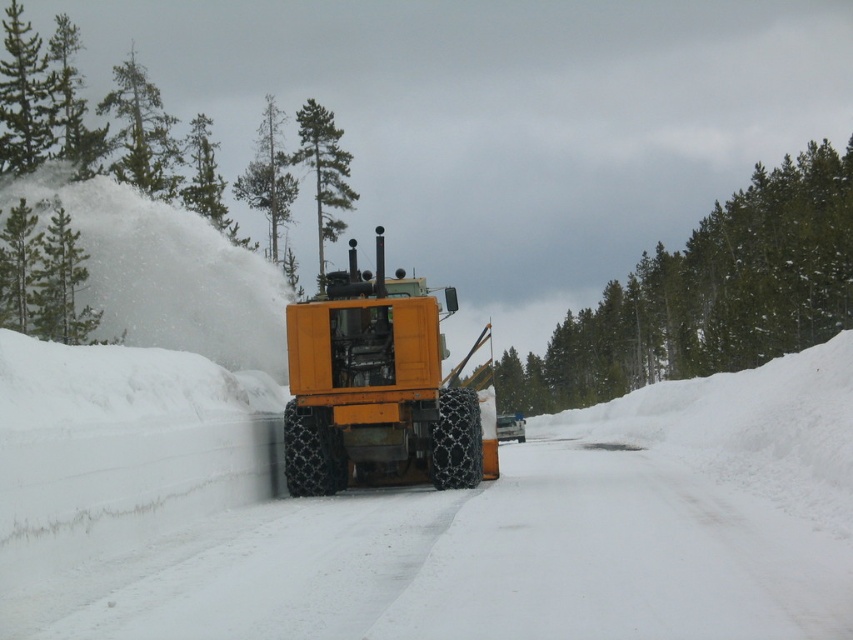
You are standing at the point with coordinates point (840, 468) and want to move towards the point with coordinates point (467, 465). Given that the snowplow is actively clearing the road, which direction should you walk to reach your destination?

Since point (840, 468) is closer to the camera than point (467, 465), you should walk away from the camera towards the snowplow to reach your destination.

You are a delivery driver trying to navigate through the snow. You see the point marked at coordinate (459, 528). What object is located at that point?

The point at coordinate (459, 528) indicates the yellow rubber snowplow at center.

You are a driver trying to pass through this snowy road and see the yellow rubber snowplow at center and the orange rubber tractor at center. Which one is closer to the ground?

The yellow rubber snowplow at center is below orange rubber tractor at center, so the yellow rubber snowplow at center is closer to the ground.